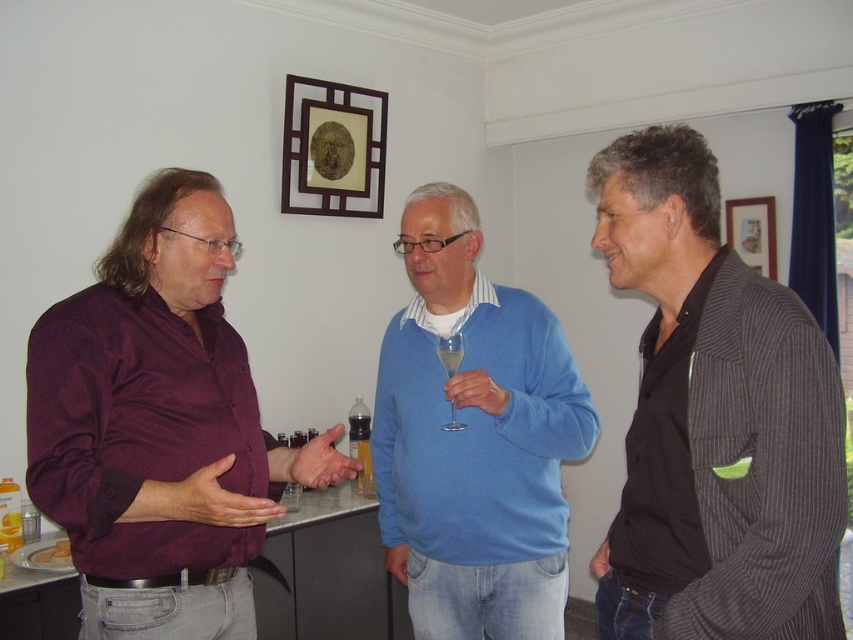
Question: Is striped wool blazer at right behind wooden picture frame at upper right?

Choices:
 (A) yes
 (B) no

Answer: (B)

Question: Considering the real-world distances, which object is farthest from the wooden picture frame at upper center?

Choices:
 (A) blue sweater at center
 (B) clear glass wine glass at center

Answer: (B)

Question: Which point is closer to the camera?

Choices:
 (A) blue sweater at center
 (B) clear glass wine glass at center
 (C) wooden picture frame at upper right
 (D) striped wool blazer at right

Answer: (D)

Question: Does wooden picture frame at upper right come in front of clear glass wine glass at center?

Choices:
 (A) yes
 (B) no

Answer: (B)

Question: Which of the following is the farthest from the observer?

Choices:
 (A) blue sweater at center
 (B) wooden picture frame at upper right
 (C) wooden picture frame at upper center
 (D) clear glass wine glass at center

Answer: (B)

Question: Is wooden picture frame at upper center wider than wooden picture frame at upper right?

Choices:
 (A) yes
 (B) no

Answer: (A)